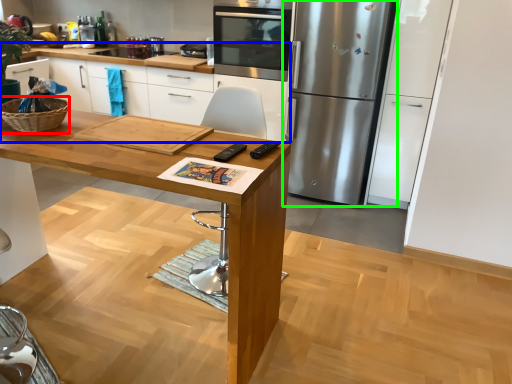
Question: Which is farther away from basket (highlighted by a red box)? cabinetry (highlighted by a blue box) or refrigerator (highlighted by a green box)?

Choices:
 (A) cabinetry
 (B) refrigerator

Answer: (A)